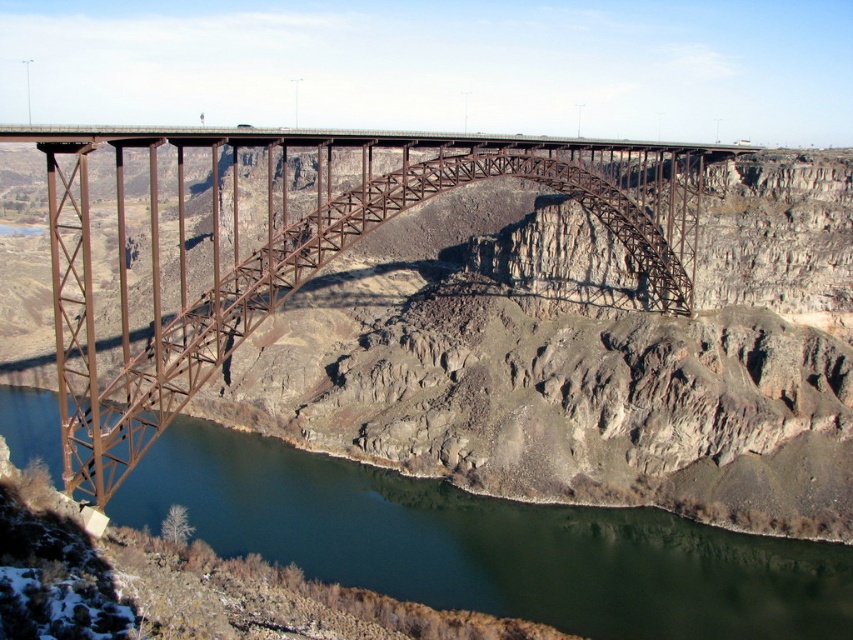
You are a drone operator tasked with capturing aerial footage of the rusty metal bridge at center. Your drone has a maximum flight range of 40 meters. Can your drone safely reach the bridge without exceeding its range limit?

The rusty metal bridge at center is 39.54 meters away from the camera. Since the drone has a maximum flight range of 40 meters, it can safely reach the bridge without exceeding its range limit as 39.54 meters is within the 40 meters limit.